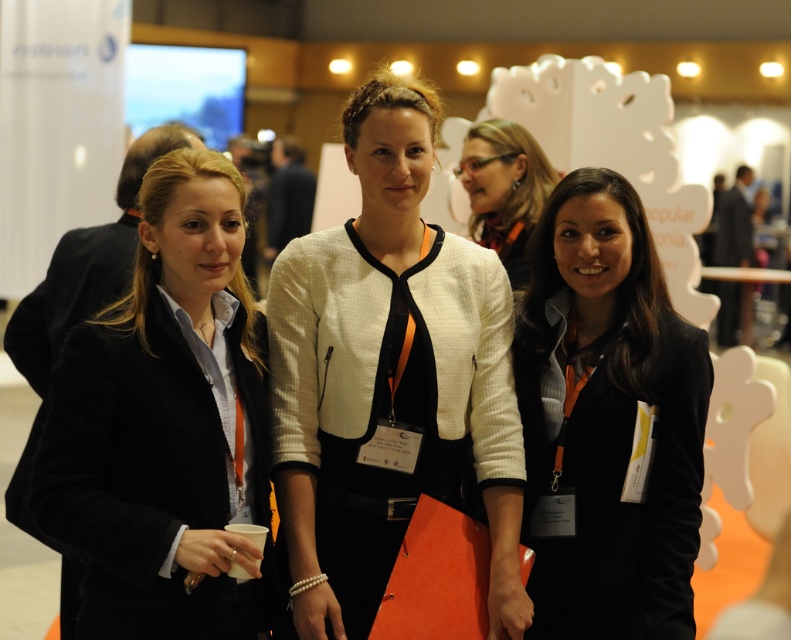
Question: Which of the following is the farthest from the observer?

Choices:
 (A) white textured blazer at center
 (B) matte black jacket at center
 (C) black matte blazer at center

Answer: (B)

Question: Observing the image, what is the correct spatial positioning of black matte blazer at center in reference to matte black jacket at center?

Choices:
 (A) left
 (B) right

Answer: (B)

Question: From the image, what is the correct spatial relationship of black matte blazer at center in relation to matte black jacket at center?

Choices:
 (A) right
 (B) left

Answer: (A)

Question: Based on their relative distances, which object is farther from the white textured blazer at center?

Choices:
 (A) black matte blazer at center
 (B) velvet black jacket at left

Answer: (B)

Question: Which of the following is the closest to the observer?

Choices:
 (A) (494, 566)
 (B) (84, 570)
 (C) (591, 624)

Answer: (A)

Question: Is velvet black jacket at left positioned in front of black matte blazer at center?

Choices:
 (A) no
 (B) yes

Answer: (B)